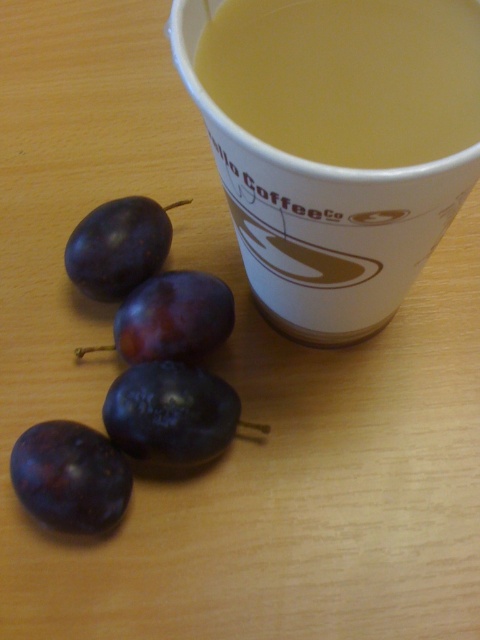
Consider the image. Who is more forward, (276, 204) or (157, 298)?

Point (276, 204)

Which of these two, yellow paper cup at upper center or shiny purple plum at center, stands shorter?

shiny purple plum at center

At what (x,y) coordinates should I click in order to perform the action: click on yellow paper cup at upper center. Please return your answer as a coordinate pair (x, y). Image resolution: width=480 pixels, height=640 pixels. Looking at the image, I should click on (323, 216).

Who is higher up, yellow liquid at upper center or shiny dark purple plum at upper left?

yellow liquid at upper center is higher up.

Is yellow liquid at upper center taller than shiny dark purple plum at upper left?

Indeed, yellow liquid at upper center has a greater height compared to shiny dark purple plum at upper left.

Is point (476, 131) in front of point (111, 211)?

Yes.

Identify the location of yellow liquid at upper center. (348, 76).

Looking at this image, can you confirm if yellow liquid at upper center is wider than yellow paper cup at upper center?

In fact, yellow liquid at upper center might be narrower than yellow paper cup at upper center.

Identify the location of yellow liquid at upper center. This screenshot has height=640, width=480. [348, 76].